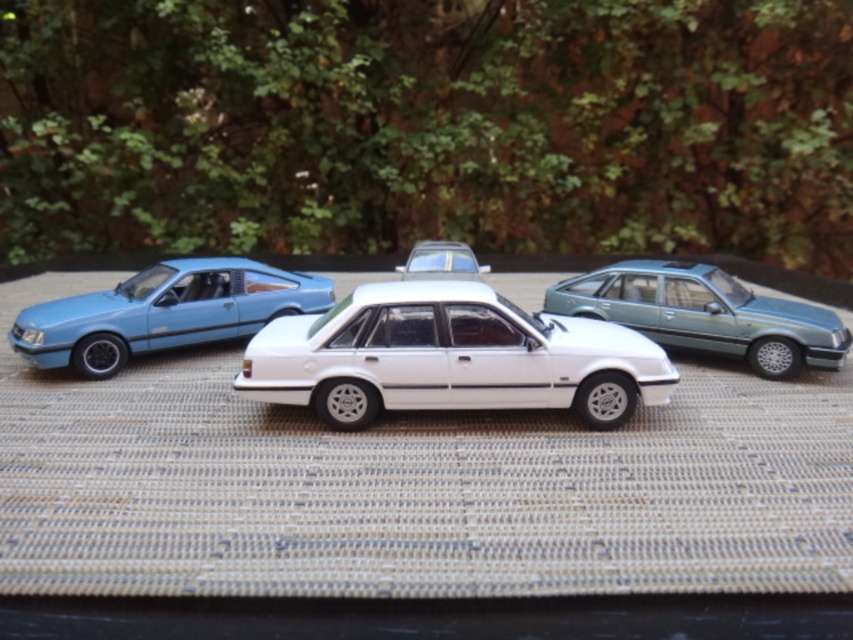
Question: Which object is the closest to the metallic teal sedan at right?

Choices:
 (A) matte blue car at left
 (B) white glossy sedan at center
 (C) transparent plastic car at center

Answer: (B)

Question: Can you confirm if matte blue car at left is positioned to the right of metallic teal sedan at right?

Choices:
 (A) no
 (B) yes

Answer: (A)

Question: Which of the following is the farthest from the observer?

Choices:
 (A) (467, 259)
 (B) (820, 365)
 (C) (154, 317)
 (D) (310, 328)

Answer: (A)

Question: Is matte blue car at left positioned at the back of transparent plastic car at center?

Choices:
 (A) no
 (B) yes

Answer: (A)

Question: Which object is closer to the camera taking this photo?

Choices:
 (A) matte blue car at left
 (B) metallic teal sedan at right
 (C) white glossy sedan at center

Answer: (C)

Question: Can you confirm if white glossy sedan at center is wider than matte blue car at left?

Choices:
 (A) no
 (B) yes

Answer: (B)